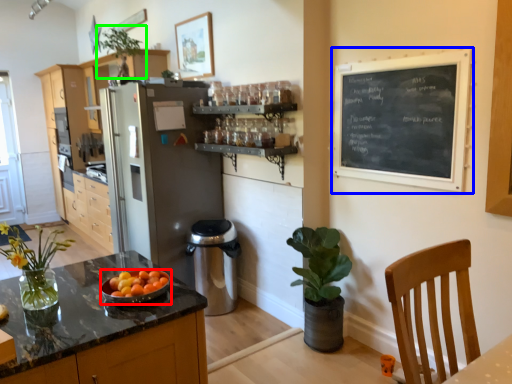
Question: Based on their relative distances, which object is farther from kitchen appliance (highlighted by a red box)? Choose from bulletin board (highlighted by a blue box) and houseplant (highlighted by a green box).

Choices:
 (A) bulletin board
 (B) houseplant

Answer: (B)